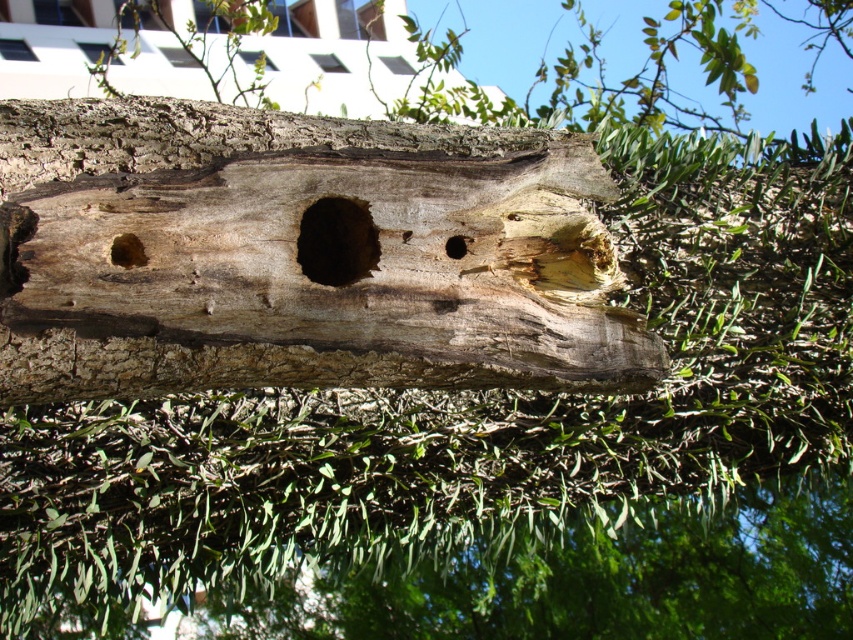
Who is positioned more to the left, brown rough hole at center or brown rough hole at left?

Positioned to the left is brown rough hole at left.

Is brown rough hole at center bigger than brown rough hole at left?

Yes.

The width and height of the screenshot is (853, 640). What do you see at coordinates (337, 241) in the screenshot?
I see `brown rough hole at center` at bounding box center [337, 241].

Where is `brown rough hole at center`? The image size is (853, 640). brown rough hole at center is located at coordinates (337, 241).

From the picture: Which is above, weathered wood log at center or brown rough hole at center?

Positioned higher is brown rough hole at center.

Consider the image. Can you confirm if weathered wood log at center is positioned to the left of brown rough hole at center?

Incorrect, weathered wood log at center is not on the left side of brown rough hole at center.

Between point (518, 196) and point (347, 260), which one is positioned behind?

Positioned behind is point (347, 260).

Find the location of a particular element. The height and width of the screenshot is (640, 853). weathered wood log at center is located at coordinates (294, 256).

Which is in front, point (131, 240) or point (453, 237)?

Point (131, 240) is in front.

At what (x,y) coordinates should I click in order to perform the action: click on brown rough hole at left. Please return your answer as a coordinate pair (x, y). The height and width of the screenshot is (640, 853). Looking at the image, I should click on (126, 250).

Is point (122, 259) farther from camera compared to point (448, 257)?

No, (122, 259) is closer to viewer.

You are a GUI agent. You are given a task and a screenshot of the screen. Output one action in this format:
    pyautogui.click(x=<x>, y=<y>)
    Task: Click on the brown rough hole at left
    
    Given the screenshot: What is the action you would take?
    pyautogui.click(x=126, y=250)